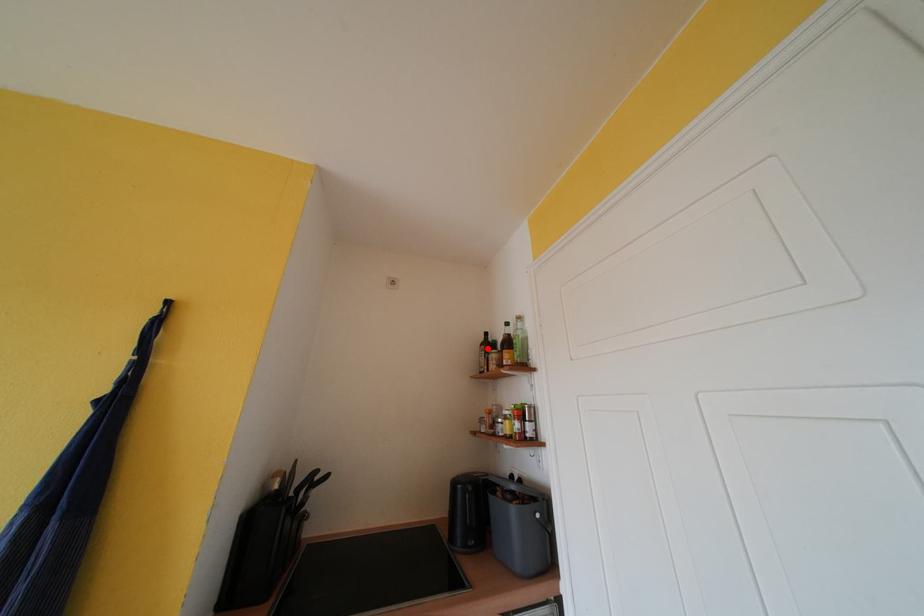
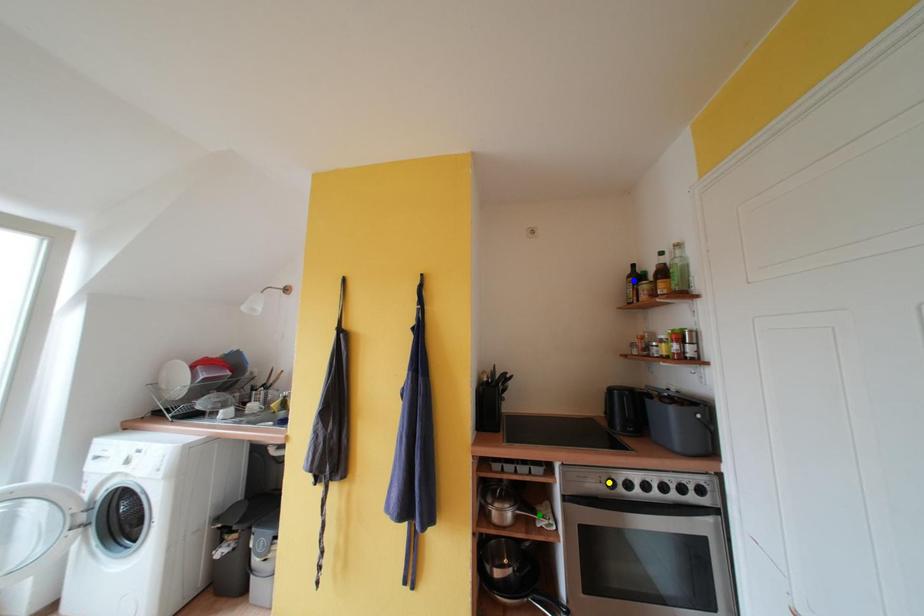
Question: I am providing you with two images of the same scene from different viewpoints. A red point is marked on the first image. You are given multiple points on the second image. Which spot in image 2 lines up with the point in image 1?

Choices:
 (A) green point
 (B) blue point
 (C) yellow point

Answer: (B)